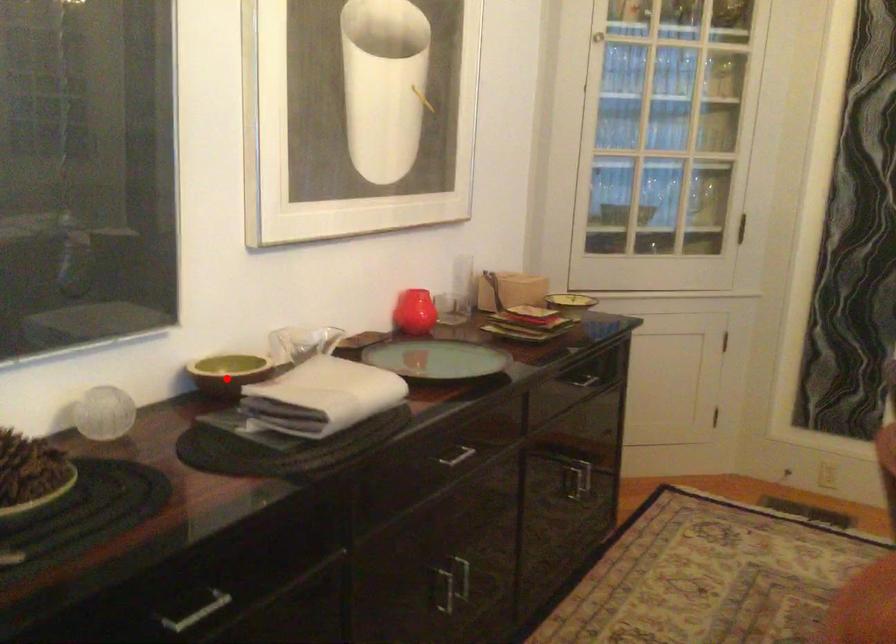
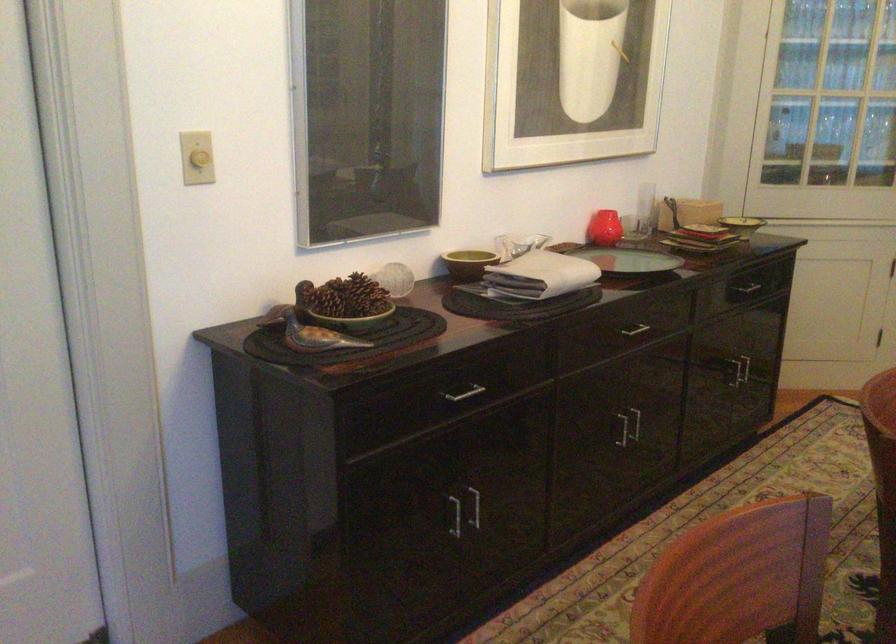
The point at the highlighted location is marked in the first image. Where is the corresponding point in the second image?

(468, 263)